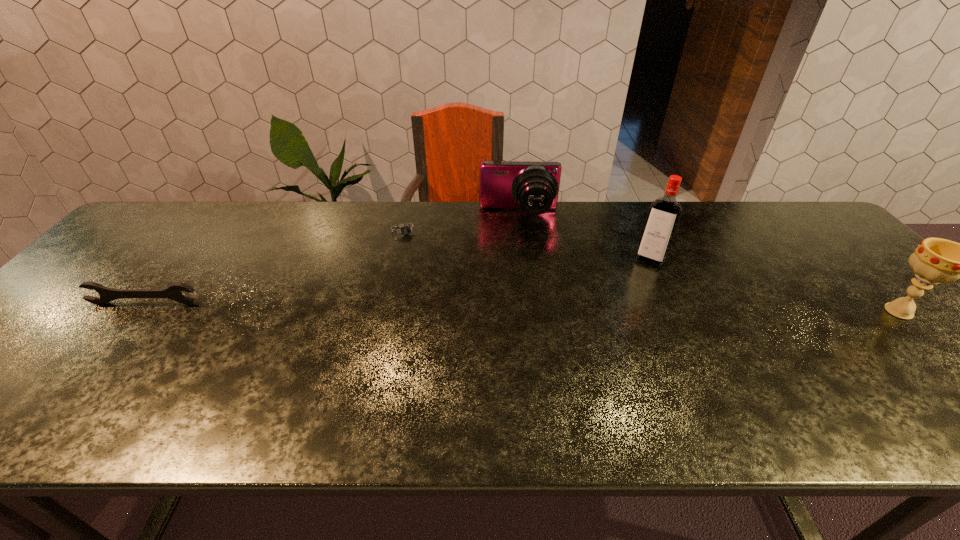
This screenshot has height=540, width=960. In order to click on the fourth tallest object in this screenshot , I will do `click(173, 292)`.

Where is `wrench`? The height and width of the screenshot is (540, 960). wrench is located at coordinates (173, 292).

Identify the location of chalice. This screenshot has height=540, width=960. (935, 260).

The image size is (960, 540). Find the location of `the second tallest object`. the second tallest object is located at coordinates (935, 260).

The image size is (960, 540). Identify the location of vodka. (664, 214).

Identify the location of the second object from right to left. The image size is (960, 540). (664, 214).

The width and height of the screenshot is (960, 540). Identify the location of the shortest object. (405, 230).

You are a GUI agent. You are given a task and a screenshot of the screen. Output one action in this format:
    pyautogui.click(x=<x>, y=<y>)
    Task: Click on the fourth object from right to left
    
    Given the screenshot: What is the action you would take?
    405,230

In order to click on camera in this screenshot , I will do `click(532, 186)`.

At what (x,y) coordinates should I click in order to perform the action: click on the third shortest object. Please return your answer as a coordinate pair (x, y). The image size is (960, 540). Looking at the image, I should click on (532, 186).